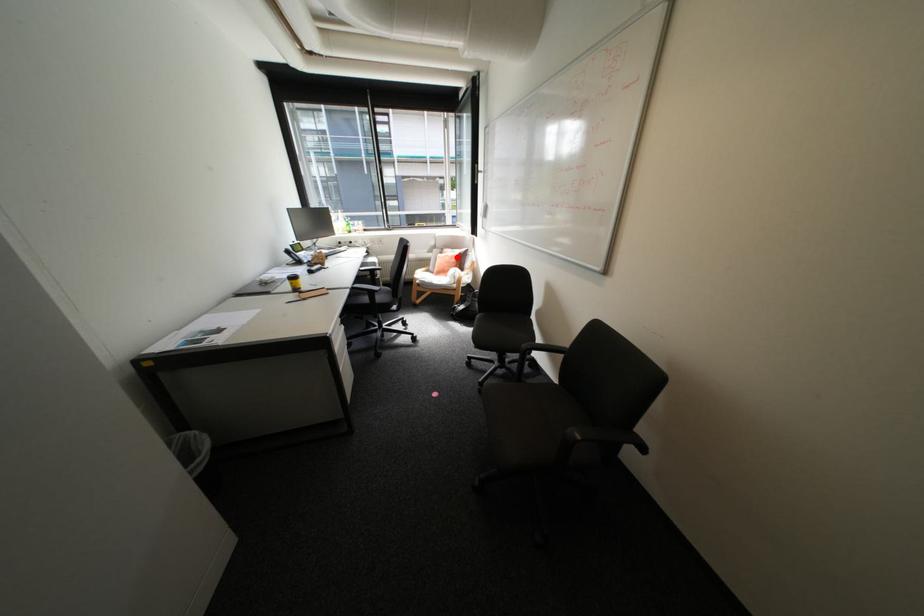
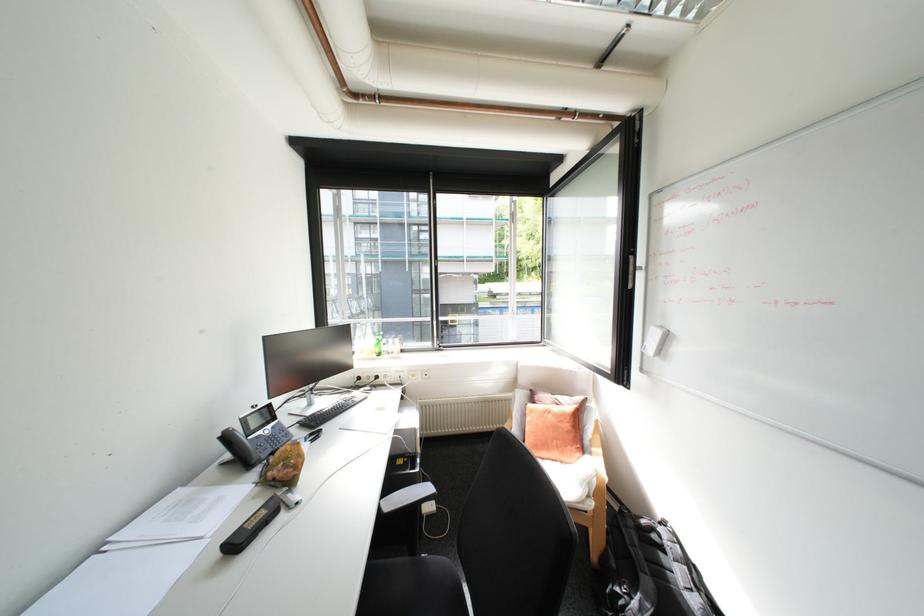
Question: I am providing you with two images of the same scene from different viewpoints. In image1, a red point is highlighted. Considering the same 3D point in image2, which of the following is correct?

Choices:
 (A) It is closer
 (B) It is farther

Answer: (B)